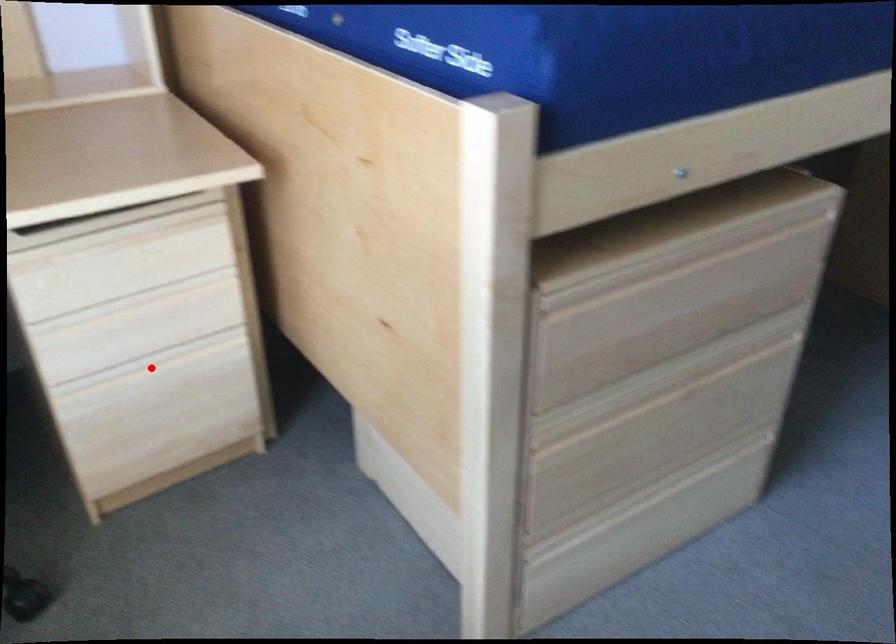
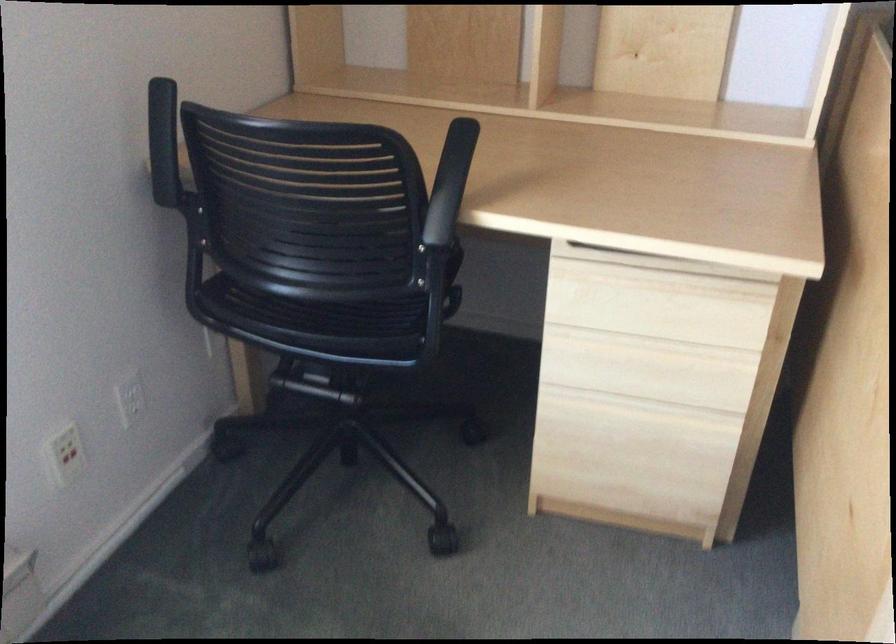
The point at the highlighted location is marked in the first image. Where is the corresponding point in the second image?

(632, 409)